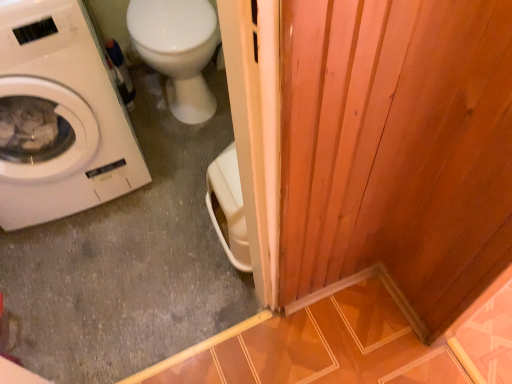
Question: Is white glossy toilet at upper left placed right next to white matte washing machine at left?

Choices:
 (A) no
 (B) yes

Answer: (A)

Question: Is white glossy toilet at upper left bigger than white matte washing machine at left?

Choices:
 (A) yes
 (B) no

Answer: (B)

Question: From a real-world perspective, is white glossy toilet at upper left over white matte washing machine at left?

Choices:
 (A) no
 (B) yes

Answer: (A)

Question: Is white glossy toilet at upper left not inside white matte washing machine at left?

Choices:
 (A) no
 (B) yes

Answer: (B)

Question: From the image's perspective, is white glossy toilet at upper left on white matte washing machine at left?

Choices:
 (A) no
 (B) yes

Answer: (B)

Question: Is white glossy toilet at upper left surrounding white matte washing machine at left?

Choices:
 (A) yes
 (B) no

Answer: (B)

Question: Considering the relative sizes of white matte washing machine at left and white glossy toilet at upper left in the image provided, is white matte washing machine at left taller than white glossy toilet at upper left?

Choices:
 (A) no
 (B) yes

Answer: (B)

Question: From the image's perspective, would you say white matte washing machine at left is positioned over white glossy toilet at upper left?

Choices:
 (A) no
 (B) yes

Answer: (A)

Question: Can you confirm if white matte washing machine at left is smaller than white glossy toilet at upper left?

Choices:
 (A) yes
 (B) no

Answer: (B)

Question: From a real-world perspective, is white matte washing machine at left positioned over white glossy toilet at upper left based on gravity?

Choices:
 (A) yes
 (B) no

Answer: (A)

Question: Does white matte washing machine at left appear on the left side of white glossy toilet at upper left?

Choices:
 (A) yes
 (B) no

Answer: (A)

Question: Is white matte washing machine at left at the right side of white glossy toilet at upper left?

Choices:
 (A) no
 (B) yes

Answer: (A)

Question: Is white matte washing machine at left wider or thinner than white glossy toilet at upper left?

Choices:
 (A) wide
 (B) thin

Answer: (B)